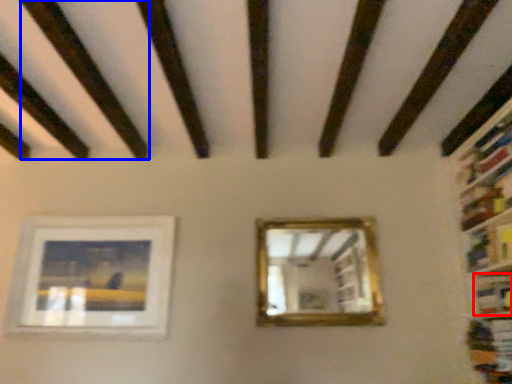
Question: Which of the following is the farthest to the observer, book (highlighted by a red box) or plank (highlighted by a blue box)?

Choices:
 (A) book
 (B) plank

Answer: (A)